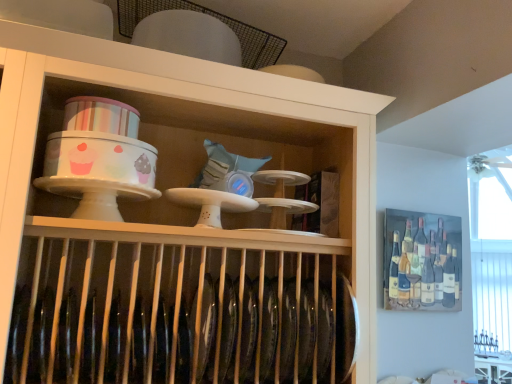
Question: Does painted wooden wine rack at upper right have a smaller size compared to white glossy table at lower right?

Choices:
 (A) no
 (B) yes

Answer: (B)

Question: From the image's perspective, is painted wooden wine rack at upper right on white glossy table at lower right?

Choices:
 (A) no
 (B) yes

Answer: (B)

Question: From a real-world perspective, is painted wooden wine rack at upper right beneath white glossy table at lower right?

Choices:
 (A) yes
 (B) no

Answer: (B)

Question: From a real-world perspective, is painted wooden wine rack at upper right on white glossy table at lower right?

Choices:
 (A) no
 (B) yes

Answer: (B)

Question: Considering the relative sizes of painted wooden wine rack at upper right and white glossy table at lower right in the image provided, is painted wooden wine rack at upper right wider than white glossy table at lower right?

Choices:
 (A) yes
 (B) no

Answer: (B)

Question: Is white glossy table at lower right in front of or behind white glossy cake stand at upper center in the image?

Choices:
 (A) front
 (B) behind

Answer: (B)

Question: Considering the positions of white glossy table at lower right and white glossy cake stand at upper center in the image, is white glossy table at lower right wider or thinner than white glossy cake stand at upper center?

Choices:
 (A) wide
 (B) thin

Answer: (A)

Question: In the image, is white glossy table at lower right on the left side or the right side of white glossy cake stand at upper center?

Choices:
 (A) right
 (B) left

Answer: (A)

Question: Is white glossy table at lower right taller or shorter than white glossy cake stand at upper center?

Choices:
 (A) tall
 (B) short

Answer: (B)

Question: Is painted wooden wine rack at upper right inside the boundaries of white glossy table at lower right, or outside?

Choices:
 (A) inside
 (B) outside

Answer: (B)

Question: Considering the positions of point (431, 258) and point (505, 370), is point (431, 258) closer or farther from the camera than point (505, 370)?

Choices:
 (A) farther
 (B) closer

Answer: (B)

Question: From a real-world perspective, relative to white glossy table at lower right, is painted wooden wine rack at upper right vertically above or below?

Choices:
 (A) above
 (B) below

Answer: (A)

Question: In the image, is painted wooden wine rack at upper right on the left side or the right side of white glossy table at lower right?

Choices:
 (A) right
 (B) left

Answer: (B)

Question: In the image, is white glossy cake stand at upper center on the left side or the right side of white glossy table at lower right?

Choices:
 (A) right
 (B) left

Answer: (B)

Question: From a real-world perspective, is white glossy cake stand at upper center positioned above or below white glossy table at lower right?

Choices:
 (A) below
 (B) above

Answer: (B)